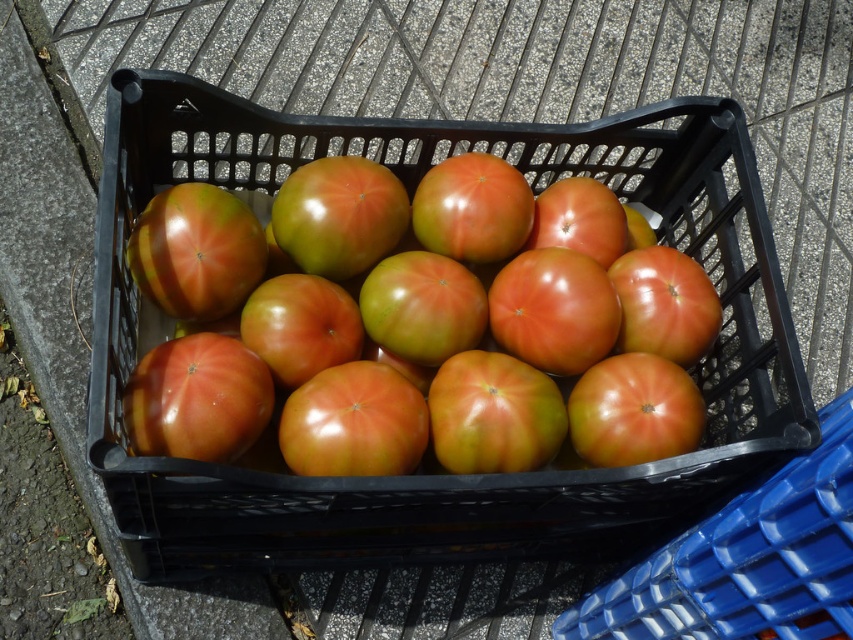
You are a delivery person who needs to place a 30 cm wide box between the matte black basket at center and the shiny red tomato at center. Can you fit it there without moving either object?

The distance between the matte black basket at center and the shiny red tomato at center is 31.38 centimeters. Since the box is 30 cm wide, it can fit between them as there is enough space.

You are organizing a picnic and need to carry both the matte black basket at center and the shiny red tomato at center. If you have a small backpack with limited space, which item should you place first to ensure both fit?

Since the matte black basket at center is larger than the shiny red tomato at center, you should place the matte black basket at center first in your backpack to accommodate its size, then add the smaller shiny red tomato at center on top or beside it.

Based on the photo, you are a delivery person who needs to move the matte black basket at center to a storage area 30 inches away. Can you move it without moving any other objects in the scene?

The distance between the matte black basket at center and the storage area is 28.95 inches, so yes, you can move it without moving other objects since the distance is within the required 30 inches.